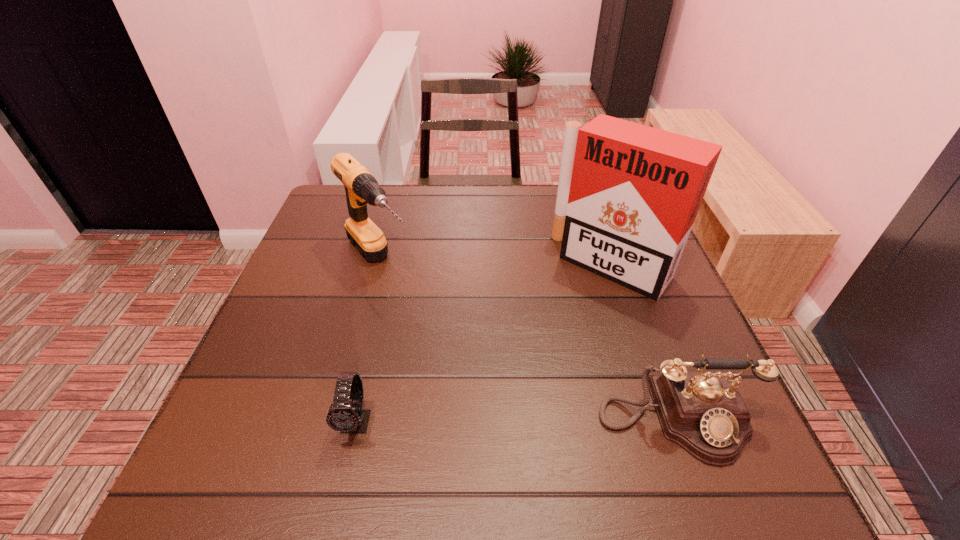
Where is `watch`? The image size is (960, 540). watch is located at coordinates (347, 418).

Identify the location of telephone. (703, 412).

This screenshot has width=960, height=540. What are the coordinates of `cigarette case` in the screenshot? It's located at (628, 194).

Find the location of a particular element. The height and width of the screenshot is (540, 960). drill is located at coordinates (361, 188).

Image resolution: width=960 pixels, height=540 pixels. Identify the location of vacant region located on the front-facing side of the tallest object. (541, 345).

The width and height of the screenshot is (960, 540). I want to click on free space located 0.190m on the front-facing side of the tallest object, so click(541, 345).

Identify the location of vacant region located on the front-facing side of the tallest object. The image size is (960, 540). (517, 374).

At what (x,y) coordinates should I click in order to perform the action: click on free space located at the tip of the drill. Please return your answer as a coordinate pair (x, y). This screenshot has width=960, height=540. Looking at the image, I should click on (499, 409).

Find the location of a particular element. Image resolution: width=960 pixels, height=540 pixels. blank area located 0.210m at the tip of the drill is located at coordinates (447, 349).

You are a GUI agent. You are given a task and a screenshot of the screen. Output one action in this format:
    pyautogui.click(x=<x>, y=<y>)
    Task: Click on the free region located 0.240m at the tip of the drill
    The image size is (960, 540).
    Given the screenshot: What is the action you would take?
    pyautogui.click(x=456, y=359)